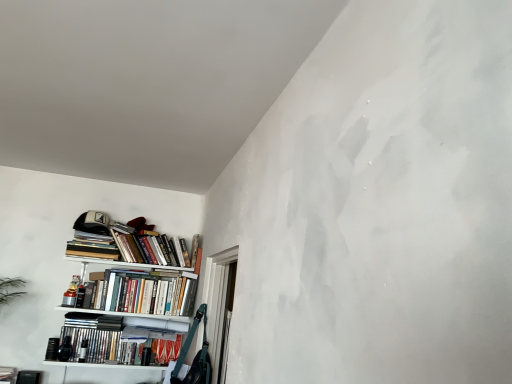
Question: From the image's perspective, is hardcover books at upper left, the second book positioned from the top, positioned above or below hardcover books at center, the 2th book ordered from the bottom?

Choices:
 (A) above
 (B) below

Answer: (A)

Question: Is hardcover books at upper left, arranged as the 3th book when ordered from the bottom, spatially inside hardcover books at center, the 2th book ordered from the bottom, or outside of it?

Choices:
 (A) inside
 (B) outside

Answer: (B)

Question: Which is nearer to the white matte bookshelf at left?

Choices:
 (A) matte black bookshelf at lower left, the 4th book positioned from the top
 (B) transparent plastic window at lower left
 (C) hardcover books at left, arranged as the 4th book when ordered from the bottom
 (D) hardcover books at upper left, the second book positioned from the top
 (E) hardcover books at center, which is counted as the third book, starting from the top

Answer: (E)

Question: Which of these objects is positioned farthest from the hardcover books at center, the 2th book ordered from the bottom?

Choices:
 (A) hardcover books at upper left, arranged as the 3th book when ordered from the bottom
 (B) white matte bookshelf at left
 (C) matte black bookshelf at lower left, which is the first book from bottom to top
 (D) hardcover books at left, arranged as the 4th book when ordered from the bottom
 (E) transparent plastic window at lower left

Answer: (E)